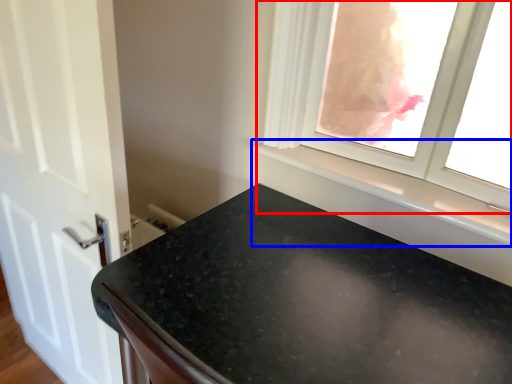
Question: Which object appears farthest to the camera in this image, window (highlighted by a red box) or window sill (highlighted by a blue box)?

Choices:
 (A) window
 (B) window sill

Answer: (B)